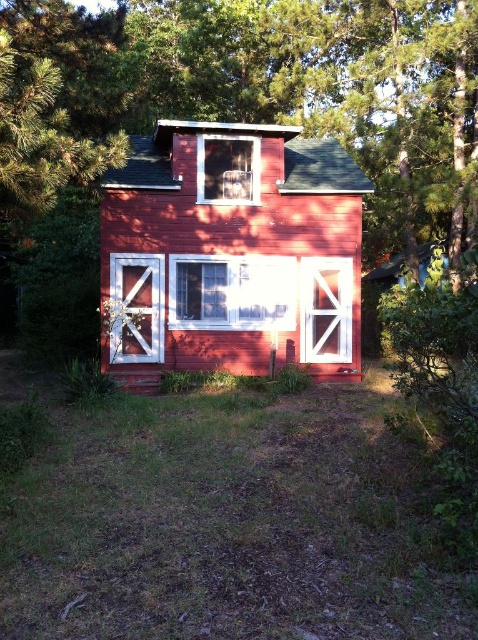
Question: Which of the following is the farthest from the observer?

Choices:
 (A) white wood barn door at center
 (B) white wood barn door at lower left
 (C) smooth red barn at center
 (D) green textured tree at upper center

Answer: (C)

Question: Can you confirm if white wood barn door at lower left is positioned to the left of white wood barn door at center?

Choices:
 (A) no
 (B) yes

Answer: (B)

Question: Which point is closer to the camera taking this photo?

Choices:
 (A) (335, 298)
 (B) (346, 275)
 (C) (130, 42)
 (D) (136, 356)

Answer: (D)

Question: Estimate the real-world distances between objects in this image. Which object is farther from the smooth red barn at center?

Choices:
 (A) white wood barn door at lower left
 (B) green textured tree at upper center

Answer: (B)

Question: Is white wood barn door at lower left bigger than white wood barn door at center?

Choices:
 (A) no
 (B) yes

Answer: (B)

Question: Is green textured tree at upper center bigger than smooth red barn at center?

Choices:
 (A) yes
 (B) no

Answer: (A)